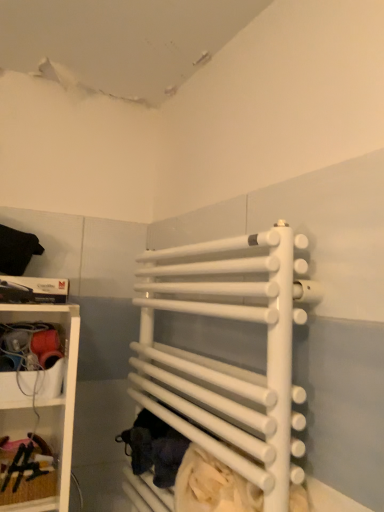
Question: Relative to wooden at left, is white matte towel rack at center in front or behind?

Choices:
 (A) front
 (B) behind

Answer: (A)

Question: Does point (307, 298) appear closer or farther from the camera than point (66, 476)?

Choices:
 (A) farther
 (B) closer

Answer: (B)

Question: Would you say white matte towel rack at center is to the left or to the right of wooden at left in the picture?

Choices:
 (A) left
 (B) right

Answer: (B)

Question: From their relative heights in the image, would you say wooden at left is taller or shorter than white matte towel rack at center?

Choices:
 (A) tall
 (B) short

Answer: (B)

Question: From the image's perspective, is wooden at left above or below white matte towel rack at center?

Choices:
 (A) below
 (B) above

Answer: (A)

Question: In terms of size, does wooden at left appear bigger or smaller than white matte towel rack at center?

Choices:
 (A) small
 (B) big

Answer: (A)

Question: Considering their positions, is wooden at left located in front of or behind white matte towel rack at center?

Choices:
 (A) front
 (B) behind

Answer: (B)